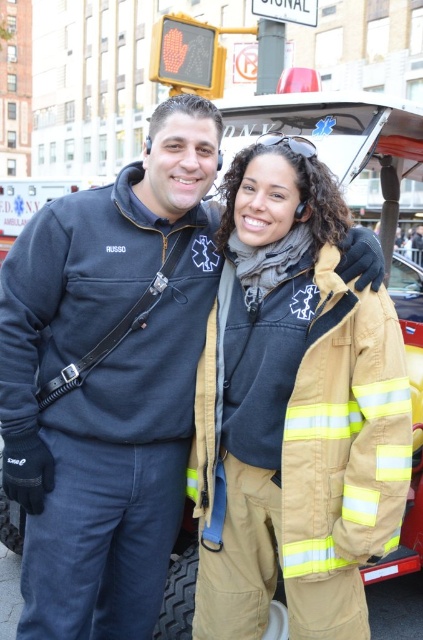
You are a delivery person trying to find the address of a client. The client mentioned that their house has a unique feature where a specific point is located on a matte black jacket at center. Can you confirm if the point at coordinates point (107,380) is indeed on the matte black jacket at center?

Yes, according to the description, the point (107,380) is on the matte black jacket at center, so the house with this feature matches the client description.